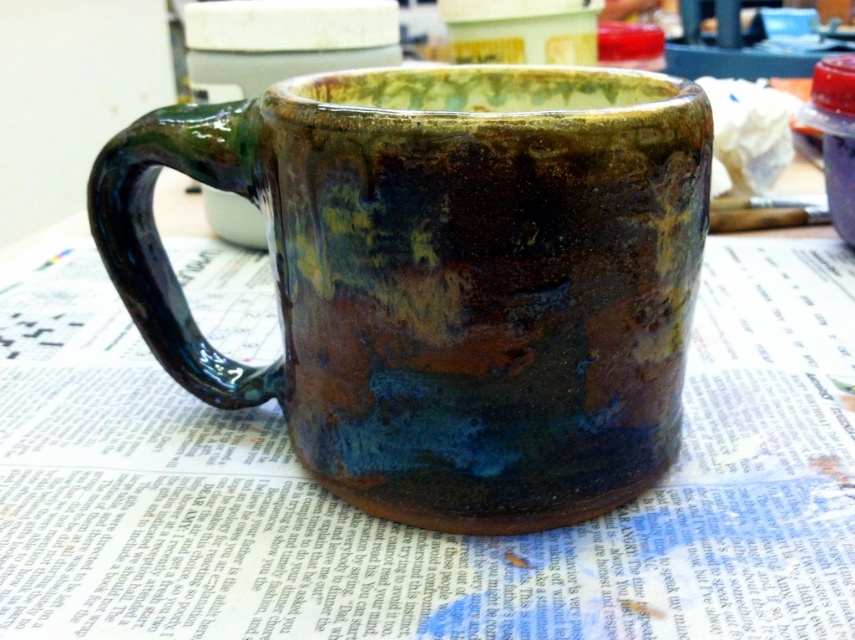
Question: Can you confirm if matte ceramic mug at center is positioned to the left of rustic ceramic mug at center?

Choices:
 (A) yes
 (B) no

Answer: (B)

Question: Among these points, which one is farthest from the camera?

Choices:
 (A) (273, 588)
 (B) (278, 288)

Answer: (B)

Question: Does matte ceramic mug at center appear under rustic ceramic mug at center?

Choices:
 (A) no
 (B) yes

Answer: (B)

Question: Among these points, which one is farthest from the camera?

Choices:
 (A) (733, 547)
 (B) (679, 200)

Answer: (A)

Question: Can you confirm if matte ceramic mug at center is thinner than rustic ceramic mug at center?

Choices:
 (A) no
 (B) yes

Answer: (A)